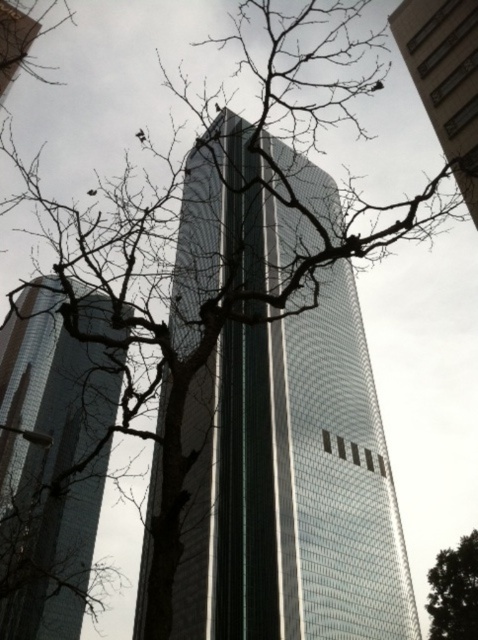
You are standing at the base of the skyscraper in the image and want to take a photo of the two points marked in the scene. Which point, point (37,605) or point (445,600), is closer to you?

Point (37,605) is behind point (445,600), so the closer point to you is point (445,600).

You are standing at the point marked by the coordinate point at point [292,484]. Looking around, you see the glassy reflective skyscraper at center. Which direction should you face to see the tree with bare branches in the foreground?

The point at [292,484] is located on the glassy reflective skyscraper at center. To see the tree with bare branches in the foreground, you should face away from the skyscraper towards the foreground where the tree is positioned.

You are a photographer planning to capture both the glassy reflective skyscraper at center and the green leafy tree at center in a single frame. Based on their heights, which object will appear larger in the photo?

The glassy reflective skyscraper at center is taller than the green leafy tree at center, so it will appear larger in the photo.